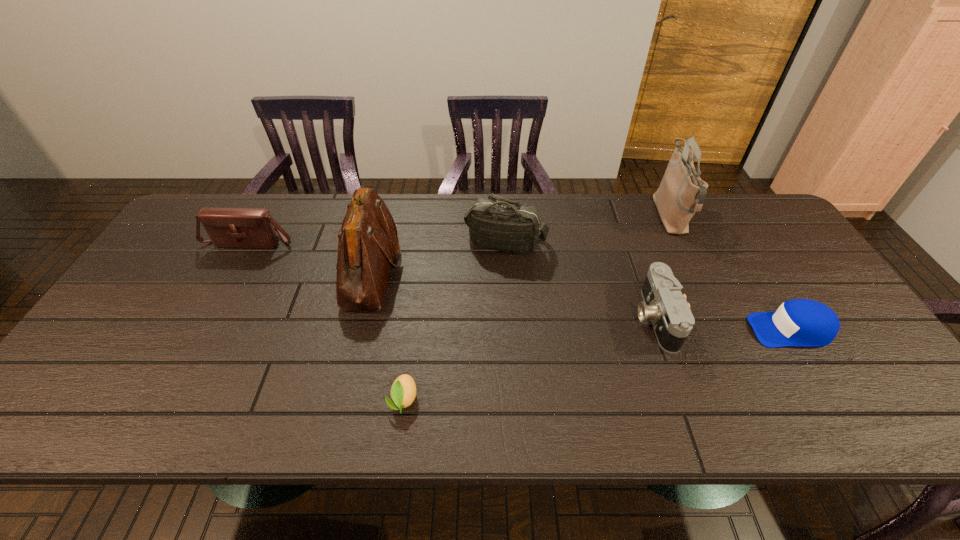
You are a GUI agent. You are given a task and a screenshot of the screen. Output one action in this format:
    pyautogui.click(x=<x>, y=<y>)
    Task: Click on the free space at the left edge of the desktop
    
    Given the screenshot: What is the action you would take?
    pyautogui.click(x=116, y=360)

You are a GUI agent. You are given a task and a screenshot of the screen. Output one action in this format:
    pyautogui.click(x=<x>, y=<y>)
    Task: Click on the free spot at the right edge of the desktop
    
    Given the screenshot: What is the action you would take?
    pyautogui.click(x=831, y=382)

Locate an element on the screen. The width and height of the screenshot is (960, 540). free point between the third shoulder bag from right to left and the third tallest object is located at coordinates (439, 256).

Find the location of a particular element. The image size is (960, 540). vacant region between the sixth object from right to left and the third shortest object is located at coordinates (514, 294).

At what (x,y) coordinates should I click in order to perform the action: click on vacant area that lies between the fifth object from right to left and the third tallest object. Please return your answer as a coordinate pair (x, y). Looking at the image, I should click on (454, 321).

The width and height of the screenshot is (960, 540). In order to click on free space between the third shoulder bag from left to right and the fifth object from right to left in this screenshot , I will do `click(454, 321)`.

The image size is (960, 540). What are the coordinates of `free space between the shortest object and the camera` in the screenshot? It's located at (529, 359).

At what (x,y) coordinates should I click in order to perform the action: click on vacant point located between the baseball cap and the fourth shortest object. Please return your answer as a coordinate pair (x, y). Image resolution: width=960 pixels, height=540 pixels. Looking at the image, I should click on (520, 286).

What are the coordinates of `empty location between the lemon and the third tallest shoulder bag` in the screenshot? It's located at (454, 321).

Where is `free space between the fifth object from left to right and the third shoulder bag from right to left`? free space between the fifth object from left to right and the third shoulder bag from right to left is located at coordinates (514, 294).